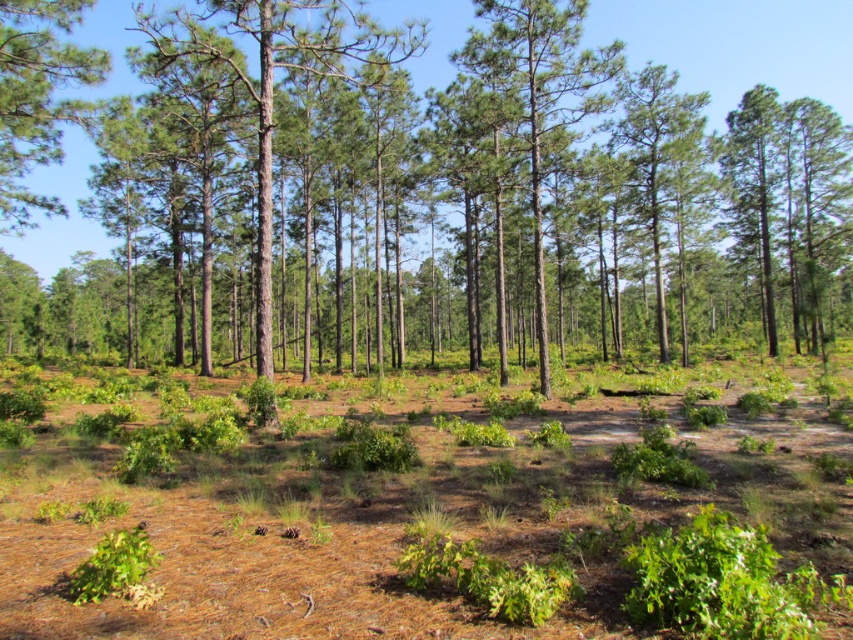
You are standing in the middle of a dense forest with tall pine trees. You notice a point marked at coordinates (x=271, y=81). What object is located at this point?

The point at (x=271, y=81) marks a smooth brown tree trunk at center.

You are a hiker trying to navigate through the forest. You see the green textured pine tree at center and the green bark tree at upper left. Which tree is positioned more to the east if the sunlight is coming from the east?

The green textured pine tree at center is to the right of the green bark tree at upper left. Since sunlight comes from the east, the tree casting a shadow to the west would be the one more to the east. However, without shadow details, we can only state their relative positions. The green textured pine tree at center is east of the green bark tree at upper left.